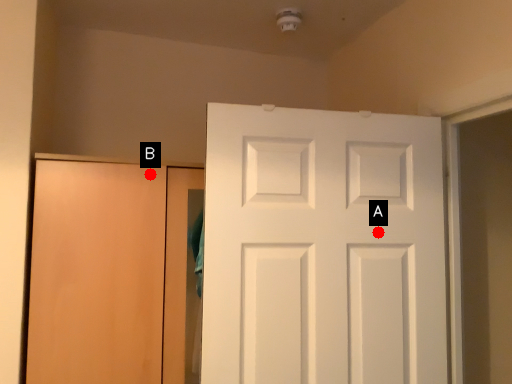
Question: Two points are circled on the image, labeled by A and B beside each circle. Which point appears closest to the camera in this image?

Choices:
 (A) A is closer
 (B) B is closer

Answer: (A)